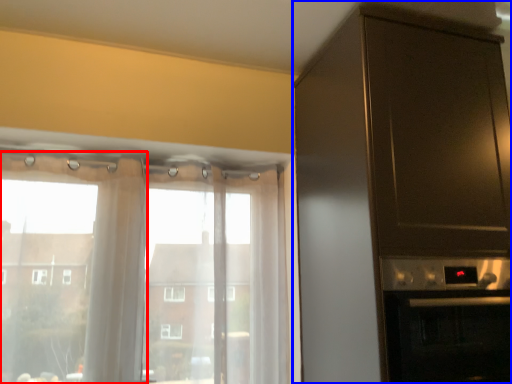
Question: Which point is further to the camera, curtain (highlighted by a red box) or cabinetry (highlighted by a blue box)?

Choices:
 (A) curtain
 (B) cabinetry

Answer: (A)